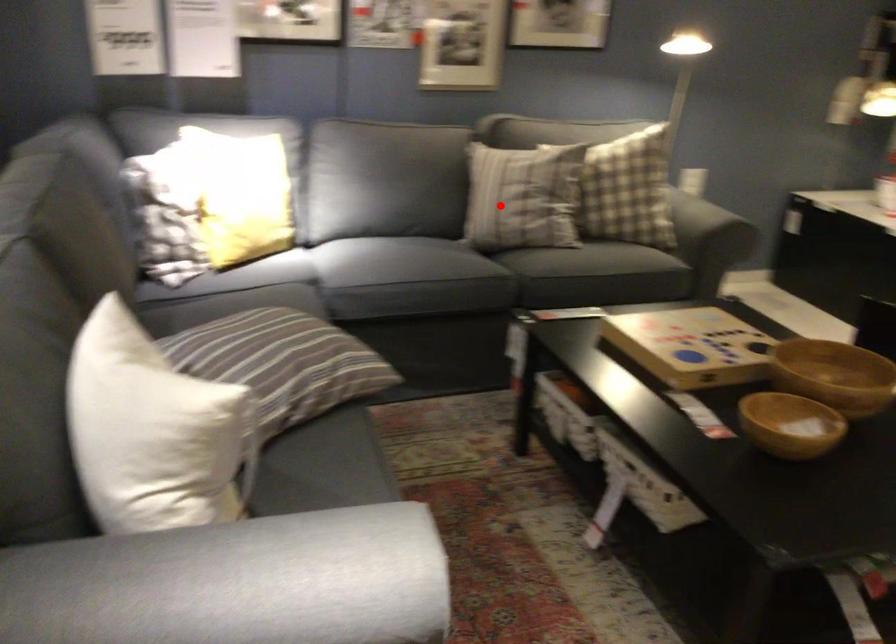
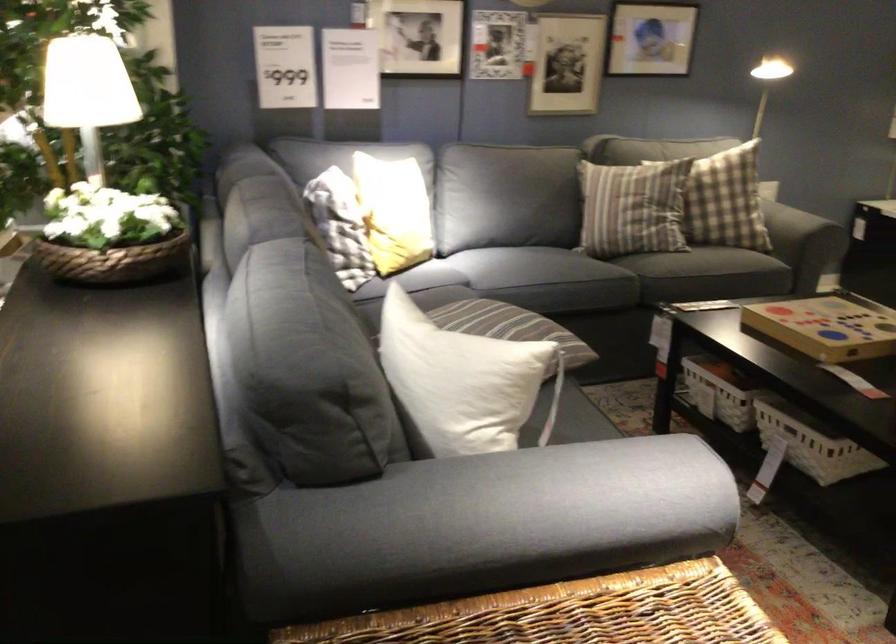
Question: I am providing you with two images of the same scene from different viewpoints. A red point is marked on the first image. Is the red point's position out of view in image 2?

Choices:
 (A) Yes
 (B) No

Answer: (B)